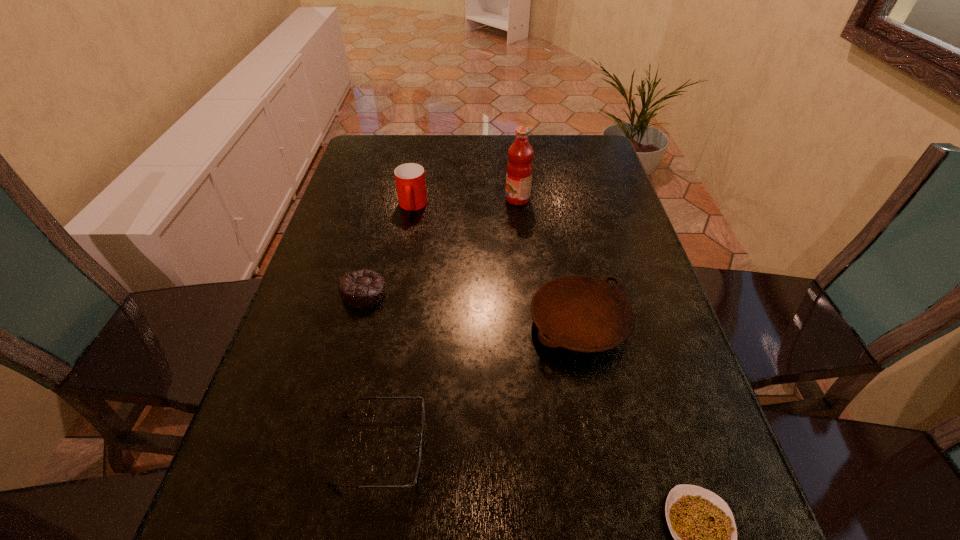
Where is `free space between the cup and the second shortest object`? The height and width of the screenshot is (540, 960). free space between the cup and the second shortest object is located at coordinates (396, 327).

The image size is (960, 540). What are the coordinates of `empty location between the fifth shortest object and the tallest object` in the screenshot? It's located at (465, 202).

Where is `free area in between the plate and the cup`? free area in between the plate and the cup is located at coordinates (496, 265).

Where is `blank region between the plate and the cup`? blank region between the plate and the cup is located at coordinates (496, 265).

Locate an element on the screen. The image size is (960, 540). vacant area that lies between the plate and the second tallest object is located at coordinates pos(496,265).

I want to click on vacant area that lies between the plate and the beanbag, so click(471, 307).

Identify the location of free area in between the spectacles and the fifth shortest object. (396, 327).

Locate which object is the second closest to the second tallest object. Please provide its 2D coordinates. Your answer should be formatted as a tuple, i.e. [(x, y)], where the tuple contains the x and y coordinates of a point satisfying the conditions above.

[(519, 170)]

This screenshot has width=960, height=540. I want to click on object that is the fifth closest to the shortest object, so click(x=410, y=178).

Where is `vacant space that satisfies the following two spatial constraints: 1. on the front side of the plate; 2. on the front-facing side of the spectacles`? The width and height of the screenshot is (960, 540). vacant space that satisfies the following two spatial constraints: 1. on the front side of the plate; 2. on the front-facing side of the spectacles is located at coordinates click(x=605, y=448).